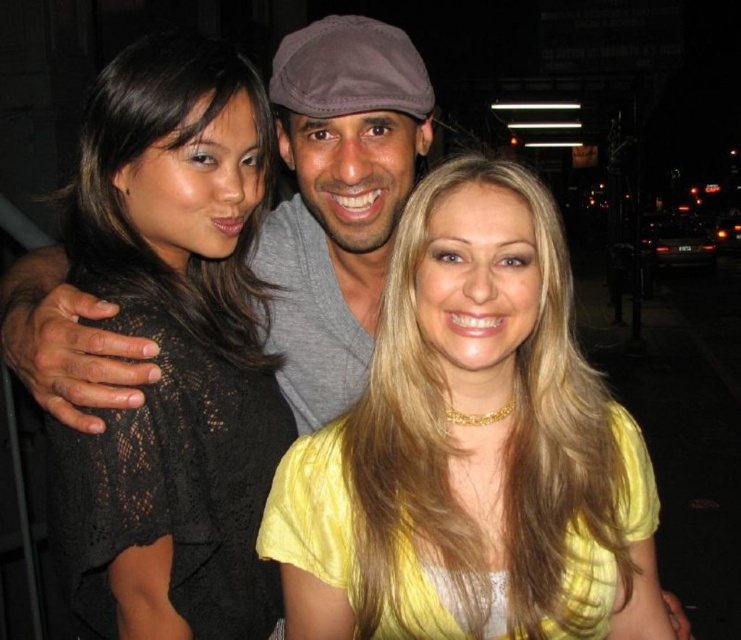
Does yellow matte shirt at center have a lesser width compared to gray matte cap at center?

Incorrect, yellow matte shirt at center's width is not less than gray matte cap at center's.

Who is higher up, yellow matte shirt at center or gray matte cap at center?

gray matte cap at center is higher up.

Does point (548, 634) lie behind point (49, 401)?

No, it is not.

Locate an element on the screen. Image resolution: width=741 pixels, height=640 pixels. yellow matte shirt at center is located at coordinates (471, 449).

Identify the location of yellow matte shirt at center. The height and width of the screenshot is (640, 741). (471, 449).

Which is in front, point (505, 195) or point (202, 296)?

Positioned in front is point (505, 195).

Find the location of a particular element. Image resolution: width=741 pixels, height=640 pixels. yellow matte shirt at center is located at coordinates (471, 449).

Is black lace top at left positioned at the back of gray matte cap at center?

No, black lace top at left is closer to the viewer.

Which is above, black lace top at left or gray matte cap at center?

gray matte cap at center is above.

What do you see at coordinates (176, 349) in the screenshot?
I see `black lace top at left` at bounding box center [176, 349].

The width and height of the screenshot is (741, 640). In order to click on black lace top at left in this screenshot , I will do 176,349.